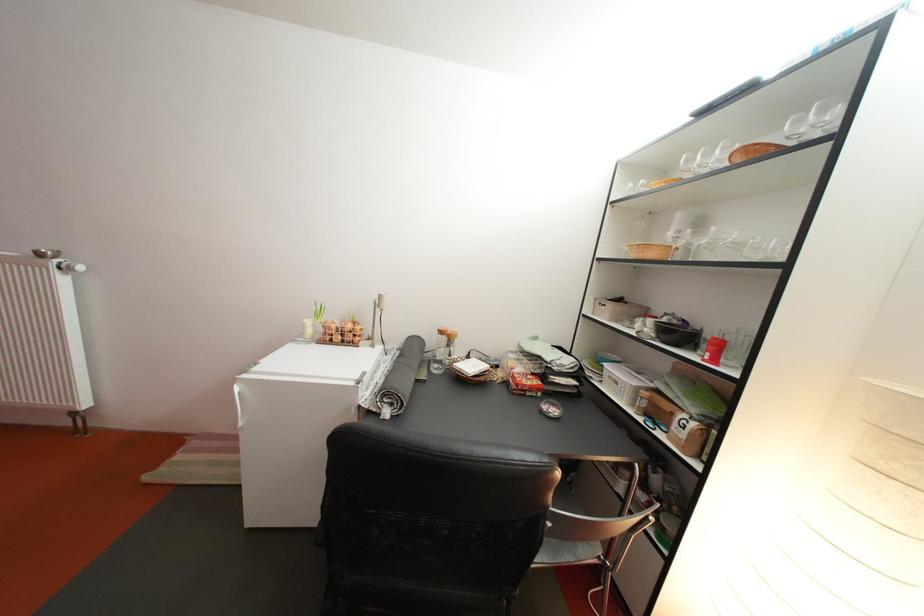
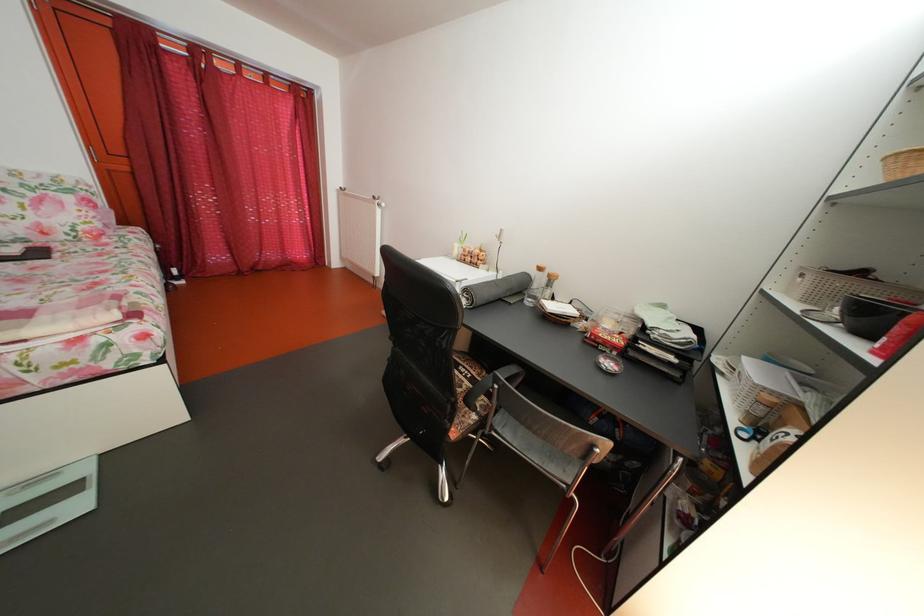
Question: The camera is either moving clockwise (left) or counter-clockwise (right) around the object. The first image is from the beginning of the video and the second image is from the end. Is the camera moving left or right when shooting the video?

Choices:
 (A) Left
 (B) Right

Answer: (B)